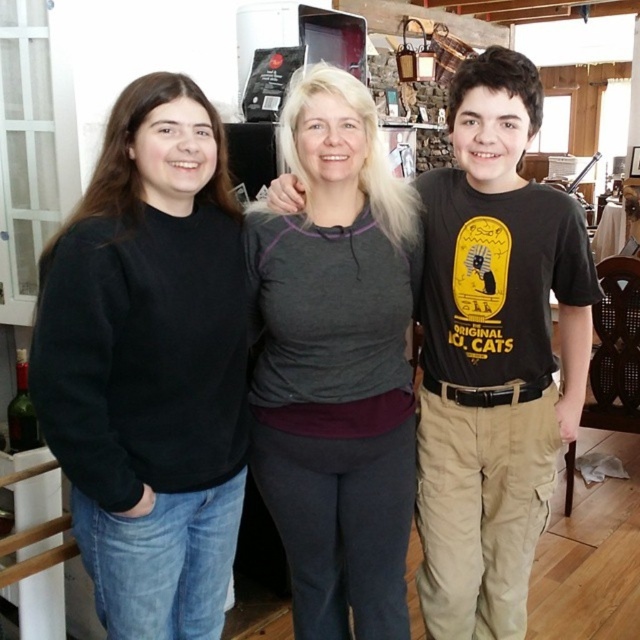
You are a photographer setting up a shoot in this scene. You need to place a small prop between the black matte sweatshirt at left and the gray fleece at center. Based on their positions, where should you position the prop relative to the two people?

The black matte sweatshirt at left is to the left of the gray fleece at center, so the prop should be placed in between them, to the right of the black matte sweatshirt at left and to the left of the gray fleece at center.